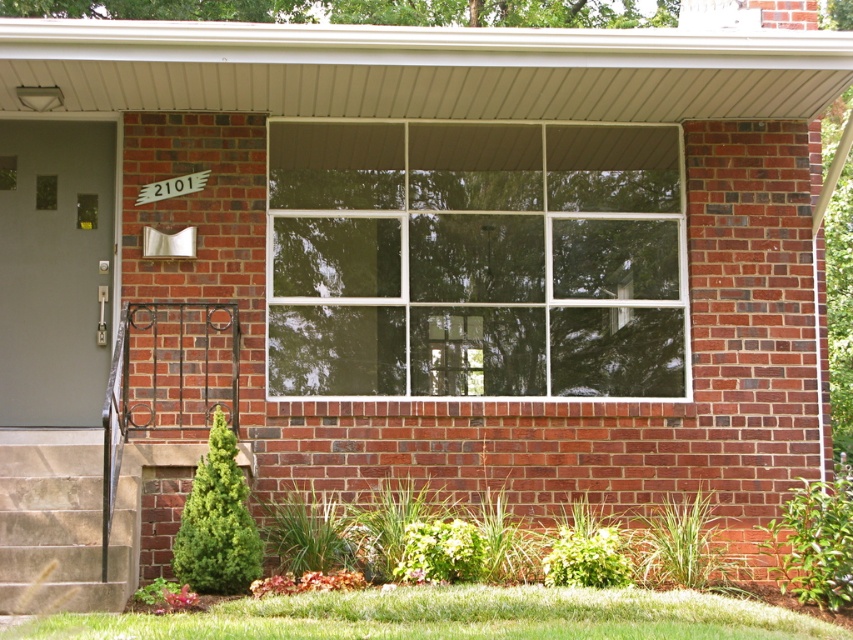
Question: Among these points, which one is farthest from the camera?

Choices:
 (A) (193, 179)
 (B) (48, 468)

Answer: (A)

Question: Can you confirm if white glass window at center is positioned above stone stairs at lower left?

Choices:
 (A) no
 (B) yes

Answer: (B)

Question: Which of these objects is positioned farthest from the white glass window at center?

Choices:
 (A) stone stairs at lower left
 (B) white plastic street sign at upper center

Answer: (A)

Question: Does white glass window at center appear on the left side of white plastic street sign at upper center?

Choices:
 (A) yes
 (B) no

Answer: (B)

Question: Does white glass window at center have a greater width compared to white plastic street sign at upper center?

Choices:
 (A) no
 (B) yes

Answer: (B)

Question: Among these objects, which one is nearest to the camera?

Choices:
 (A) stone stairs at lower left
 (B) white glass window at center
 (C) white plastic street sign at upper center

Answer: (A)